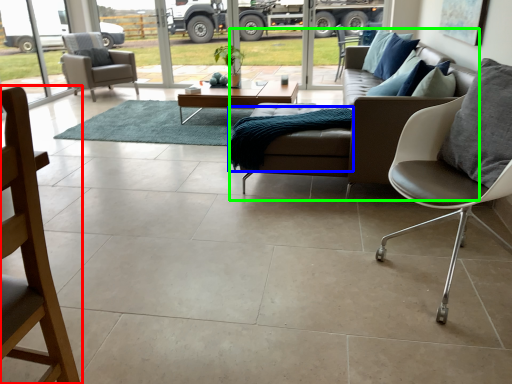
Question: Considering the real-world distances, which object is closest to chair (highlighted by a red box)? blanket (highlighted by a blue box) or studio couch (highlighted by a green box).

Choices:
 (A) blanket
 (B) studio couch

Answer: (A)